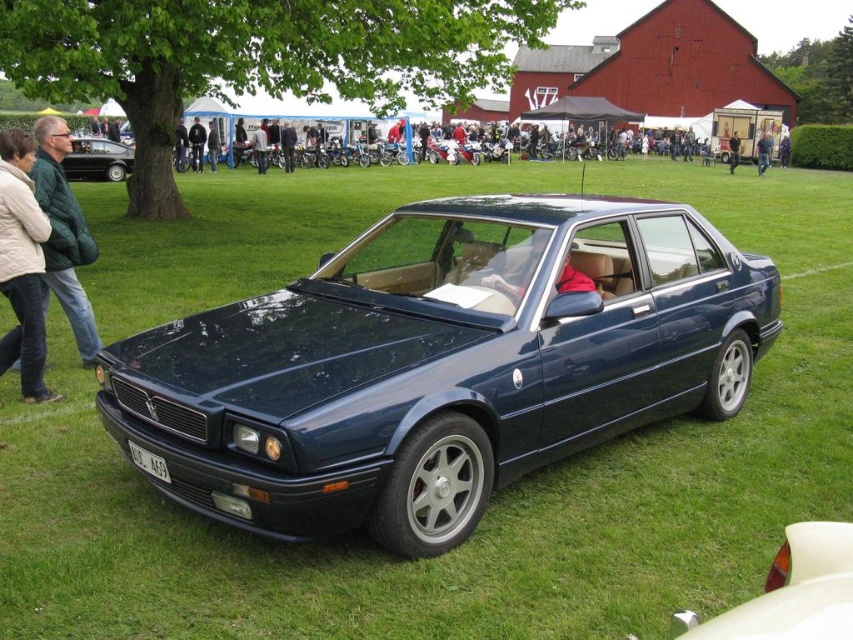
Question: Which point is farther to the camera?

Choices:
 (A) shiny black sedan at left
 (B) white plastic license plate at center
 (C) green wool coat at left

Answer: (A)

Question: Can you confirm if glossy white car at lower right is wider than black leather jacket at center?

Choices:
 (A) no
 (B) yes

Answer: (A)

Question: Is glossy dark blue sedan at center bigger than green fuzzy jacket at upper left?

Choices:
 (A) no
 (B) yes

Answer: (B)

Question: Which of the following is the closest to the observer?

Choices:
 (A) white plastic license plate at center
 (B) glossy white car at lower right

Answer: (B)

Question: Does glossy dark blue sedan at center have a larger size compared to green wool coat at left?

Choices:
 (A) no
 (B) yes

Answer: (B)

Question: Which point is closer to the camera?

Choices:
 (A) green wool coat at left
 (B) glossy white car at lower right
 (C) black leather jacket at center

Answer: (B)